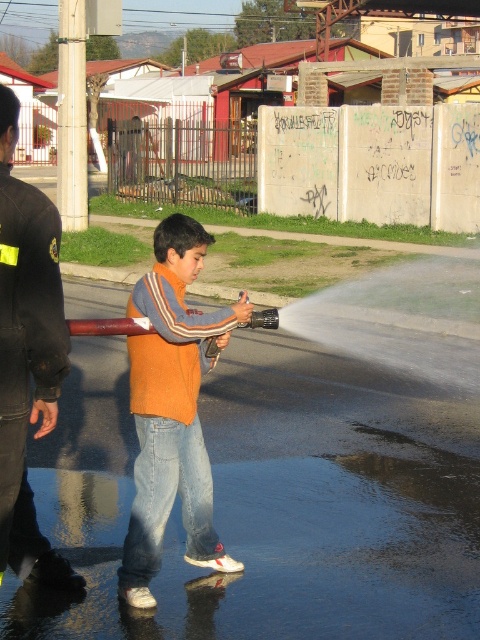
Between orange fleece at center and black leather jacket at left, which one has less height?

orange fleece at center is shorter.

Is orange fleece at center smaller than black leather jacket at left?

Yes.

You are a GUI agent. You are given a task and a screenshot of the screen. Output one action in this format:
    pyautogui.click(x=<x>, y=<y>)
    Task: Click on the orange fleece at center
    
    Given the screenshot: What is the action you would take?
    pyautogui.click(x=171, y=410)